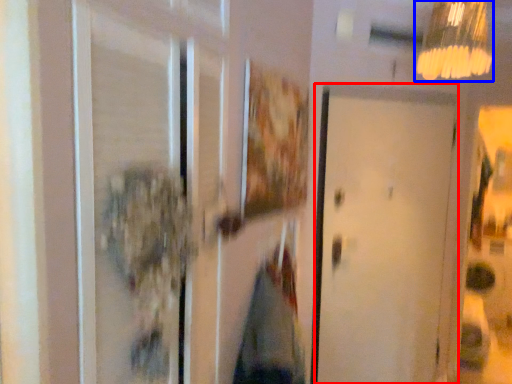
Question: Which object appears farthest to the camera in this image, door (highlighted by a red box) or lamp (highlighted by a blue box)?

Choices:
 (A) door
 (B) lamp

Answer: (A)